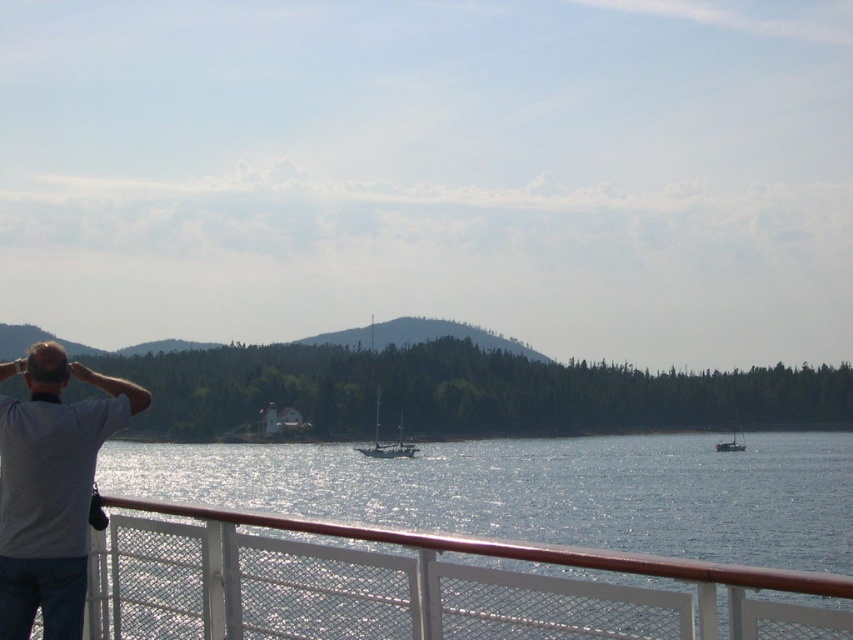
The height and width of the screenshot is (640, 853). What do you see at coordinates (540, 490) in the screenshot? I see `clear water at lower center` at bounding box center [540, 490].

What do you see at coordinates (540, 490) in the screenshot?
I see `clear water at lower center` at bounding box center [540, 490].

Where is `clear water at lower center`? This screenshot has width=853, height=640. clear water at lower center is located at coordinates (540, 490).

Does clear water at lower center appear over shiny silver sailboat at center?

No.

Between point (364, 458) and point (410, 449), which one is positioned in front?

Positioned in front is point (410, 449).

You are a GUI agent. You are given a task and a screenshot of the screen. Output one action in this format:
    pyautogui.click(x=<x>, y=<y>)
    Task: Click on the clear water at lower center
    Image resolution: width=853 pixels, height=640 pixels.
    Given the screenshot: What is the action you would take?
    pyautogui.click(x=540, y=490)

Does shiny silver sailboat at center appear over shiny black sailboat at right?

Correct, shiny silver sailboat at center is located above shiny black sailboat at right.

Who is positioned more to the right, shiny silver sailboat at center or shiny black sailboat at right?

shiny black sailboat at right

Identify the location of shiny silver sailboat at center. The width and height of the screenshot is (853, 640). (386, 442).

Find the location of `shiny silver sailboat at center`. shiny silver sailboat at center is located at coordinates (386, 442).